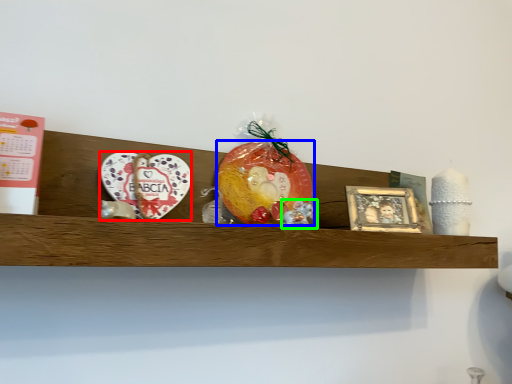
Question: Which object is positioned farthest from platter (highlighted by a red box)? Select from fruit (highlighted by a blue box) and stuff (highlighted by a green box).

Choices:
 (A) fruit
 (B) stuff

Answer: (B)